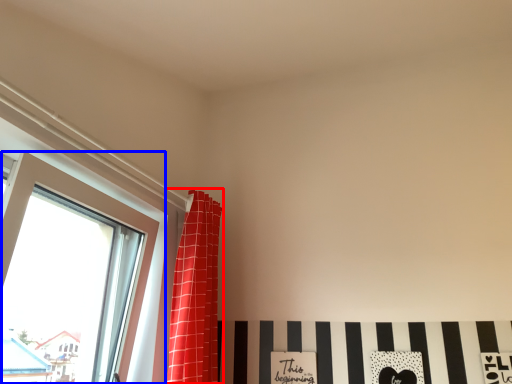
Question: Which point is further to the camera, curtain (highlighted by a red box) or window (highlighted by a blue box)?

Choices:
 (A) curtain
 (B) window

Answer: (A)